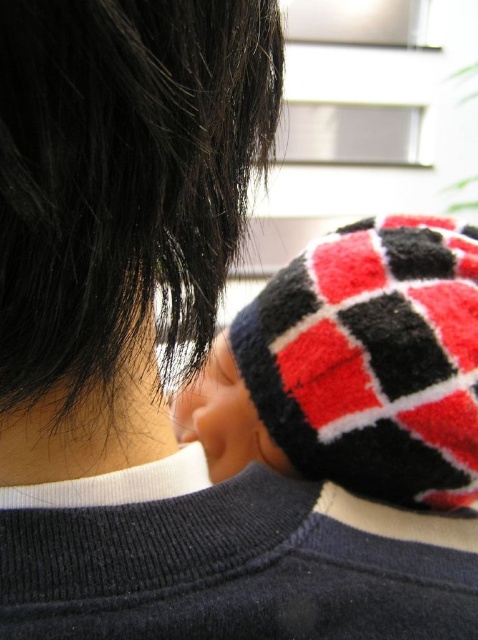
You are a photographer adjusting the lighting in a studio. You notice the shiny dark hair at upper left and the knitted wool hat at upper right in your frame. Which object should you adjust the light to highlight more, considering one is thinner than the other?

The shiny dark hair at upper left should be highlighted more because it is thinner than the knitted wool hat at upper right, making it potentially less visible without proper lighting.

You are an interior designer assessing the spatial arrangement of the room. You notice the shiny dark hair at upper left and the knitted wool hat at upper right. Which object occupies a larger area in the image?

The knitted wool hat at upper right occupies a larger area in the image because the shiny dark hair at upper left has a smaller size compared to it.